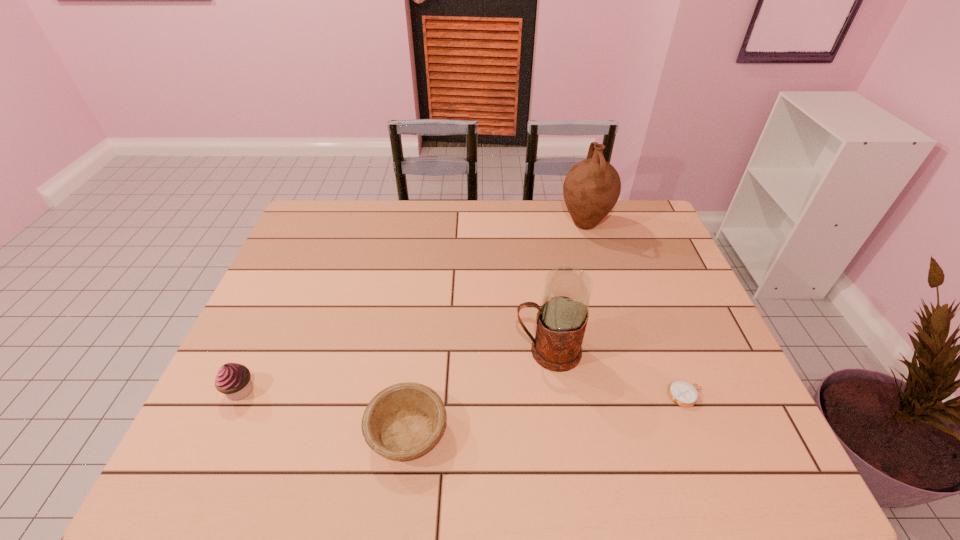
Where is `the farther pitcher`? This screenshot has height=540, width=960. the farther pitcher is located at coordinates (591, 189).

You are a GUI agent. You are given a task and a screenshot of the screen. Output one action in this format:
    pyautogui.click(x=<x>, y=<y>)
    Task: Click on the farthest object
    The width and height of the screenshot is (960, 540).
    Given the screenshot: What is the action you would take?
    pyautogui.click(x=591, y=189)

Image resolution: width=960 pixels, height=540 pixels. I want to click on the nearer pitcher, so click(x=561, y=321).

What are the coordinates of `the shorter pitcher` in the screenshot? It's located at (561, 321).

Locate an element on the screen. the third shortest object is located at coordinates (234, 380).

Identify the location of cupcake. The height and width of the screenshot is (540, 960). (234, 380).

The image size is (960, 540). Identify the location of bowl. (403, 421).

You are a GUI agent. You are given a task and a screenshot of the screen. Output one action in this format:
    pyautogui.click(x=<x>, y=<y>)
    Task: Click on the fourth tallest object
    The height and width of the screenshot is (540, 960).
    Given the screenshot: What is the action you would take?
    pyautogui.click(x=403, y=421)

I want to click on compass, so click(683, 393).

Image resolution: width=960 pixels, height=540 pixels. Identify the location of vacant area located 0.080m on the left of the right pitcher. pyautogui.click(x=536, y=224).